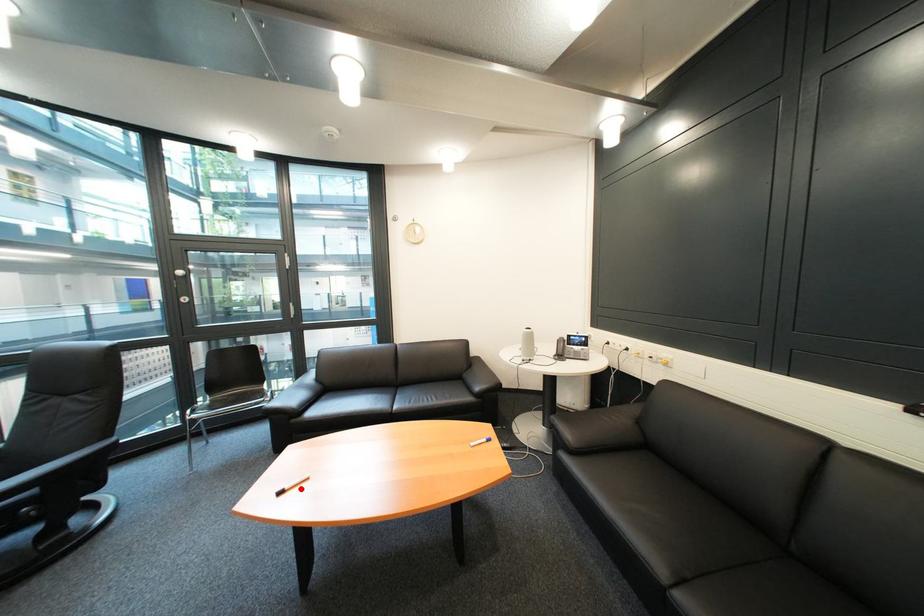
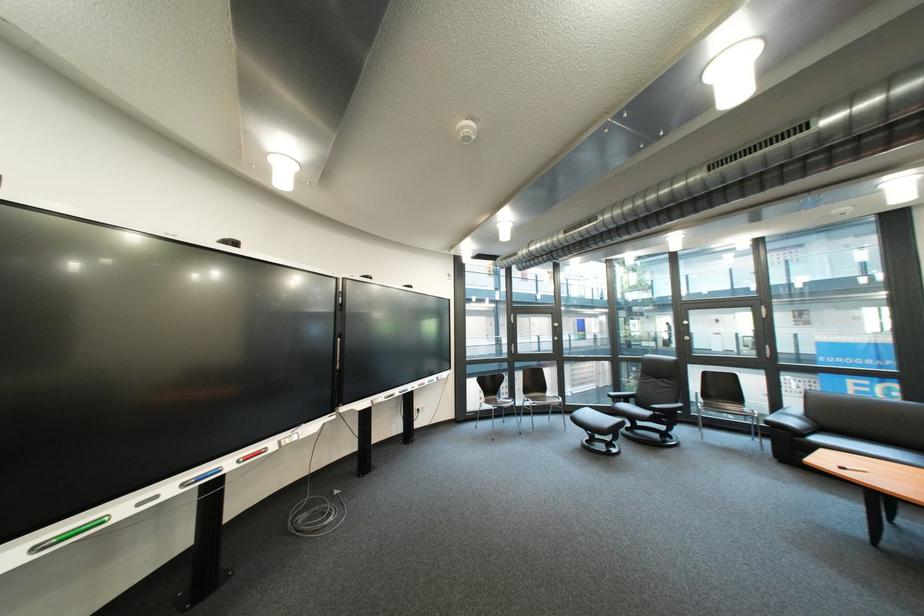
Where in the second image is the point corresponding to the highlighted location from the first image?

(862, 469)